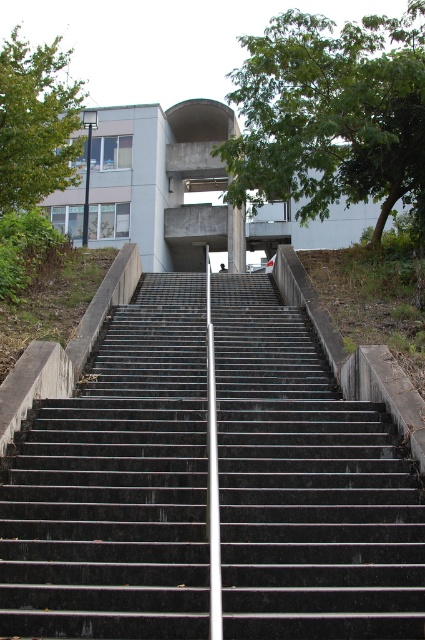
Question: Can you confirm if green leafy tree at upper center is bigger than green leafy tree at upper left?

Choices:
 (A) no
 (B) yes

Answer: (A)

Question: Does green leafy tree at upper center have a greater width compared to green leafy tree at upper left?

Choices:
 (A) yes
 (B) no

Answer: (B)

Question: Which object is farther from the camera taking this photo?

Choices:
 (A) green leafy tree at upper left
 (B) black concrete stairs at center

Answer: (A)

Question: Which point is closer to the camera taking this photo?

Choices:
 (A) (187, 428)
 (B) (0, 54)

Answer: (A)

Question: Does green leafy tree at upper center have a greater width compared to green leafy tree at upper left?

Choices:
 (A) no
 (B) yes

Answer: (A)

Question: Which object is the closest to the green leafy tree at upper center?

Choices:
 (A) green leafy tree at upper left
 (B) black concrete stairs at center

Answer: (A)